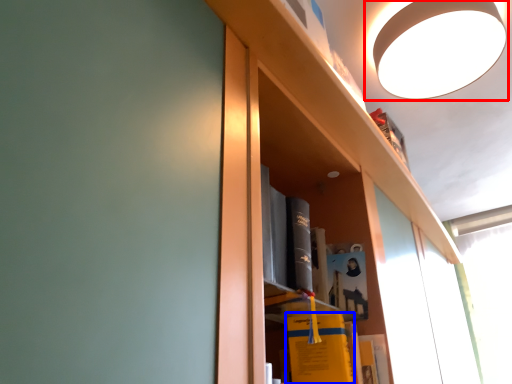
Question: Which point is further to the camera, lamp (highlighted by a red box) or book (highlighted by a blue box)?

Choices:
 (A) lamp
 (B) book

Answer: (A)